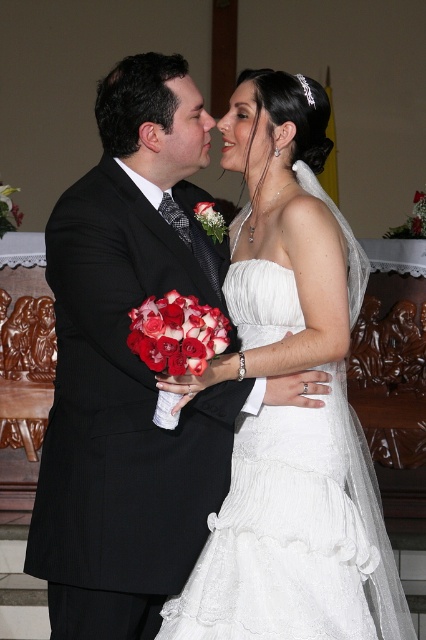
Does white satin dress at center come behind red matte rose at center?

Yes, it is.

Where is `white satin dress at center`? white satin dress at center is located at coordinates (290, 410).

In order to click on white satin dress at center in this screenshot , I will do `click(290, 410)`.

Where is `black pinstripe suit at left`? This screenshot has height=640, width=426. black pinstripe suit at left is located at coordinates (127, 372).

Who is positioned more to the right, black pinstripe suit at left or red silk bouquet at center?

red silk bouquet at center

Who is more forward, (218,454) or (212,221)?

Positioned in front is point (218,454).

I want to click on black pinstripe suit at left, so click(x=127, y=372).

Who is positioned more to the right, black pinstripe suit at left or white satin dress at center?

white satin dress at center

Is black pinstripe suit at left to the left of white satin dress at center from the viewer's perspective?

Indeed, black pinstripe suit at left is positioned on the left side of white satin dress at center.

What do you see at coordinates (127, 372) in the screenshot? I see `black pinstripe suit at left` at bounding box center [127, 372].

Where is `black pinstripe suit at left`? Image resolution: width=426 pixels, height=640 pixels. black pinstripe suit at left is located at coordinates (127, 372).